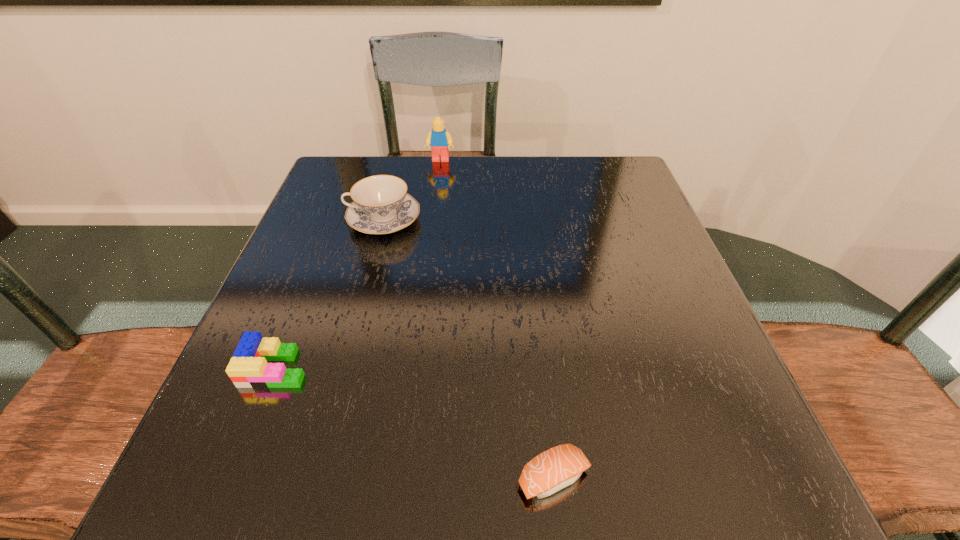
The height and width of the screenshot is (540, 960). Find the location of `the farthest object`. the farthest object is located at coordinates (439, 139).

The image size is (960, 540). Find the location of `the right Lego`. the right Lego is located at coordinates (439, 139).

Identify the location of the second farthest object. This screenshot has width=960, height=540. (381, 205).

Identify the location of the second tallest object. This screenshot has height=540, width=960. (381, 205).

Identify the location of the second shortest object. (248, 368).

Locate an element on the screen. Image resolution: width=960 pixels, height=540 pixels. the second nearest object is located at coordinates (248, 368).

Identify the location of the nearest object. (549, 472).

You are a GUI agent. You are given a task and a screenshot of the screen. Output one action in this format:
    pyautogui.click(x=<x>, y=<y>)
    Task: Click on the rightmost object
    Image resolution: width=960 pixels, height=540 pixels.
    Given the screenshot: What is the action you would take?
    pyautogui.click(x=549, y=472)

Locate an element on the screen. This screenshot has width=960, height=540. free point located on the front-facing side of the right Lego is located at coordinates (438, 181).

Locate an element on the screen. The width and height of the screenshot is (960, 540). vacant region located with the handle on the side of the chinaware is located at coordinates (306, 220).